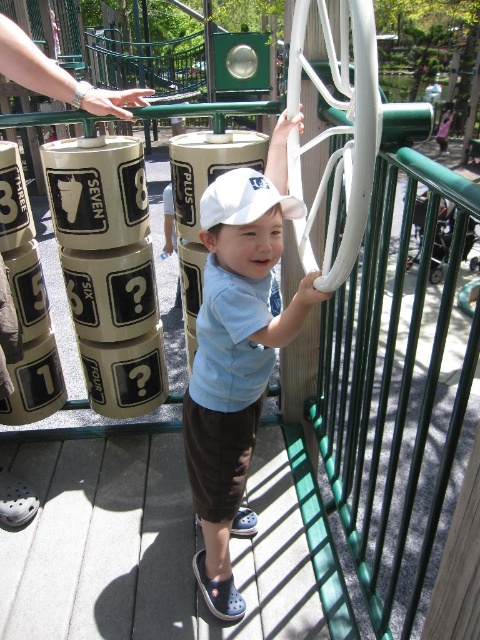
How far apart are light blue t-shirt at center and white matte baseball cap at center?

light blue t-shirt at center and white matte baseball cap at center are 12.82 inches apart.

Which is in front, point (300, 289) or point (226, 180)?

Positioned in front is point (300, 289).

Identify the location of light blue t-shirt at center. The image size is (480, 640). (237, 355).